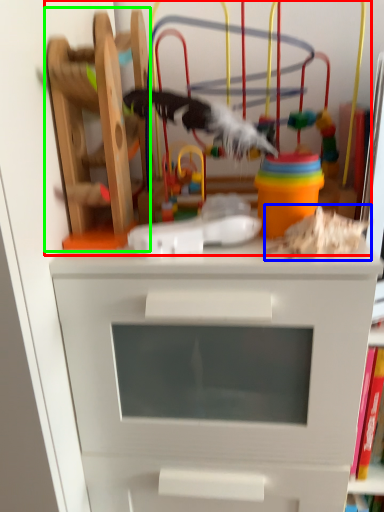
Question: Which object is positioned closest to toy (highlighted by a red box)? Select from toy (highlighted by a blue box) and toy (highlighted by a green box).

Choices:
 (A) toy
 (B) toy

Answer: (B)